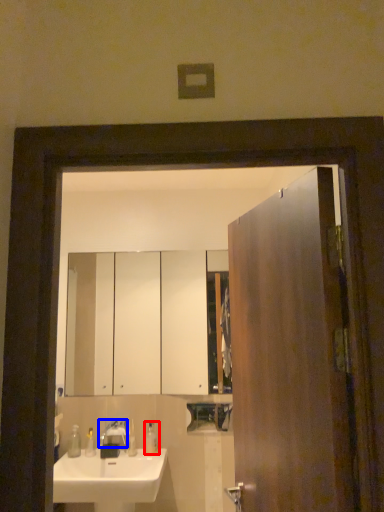
Question: Which point is closer to the camera, soap dispenser (highlighted by a red box) or tap (highlighted by a blue box)?

Choices:
 (A) soap dispenser
 (B) tap

Answer: (B)